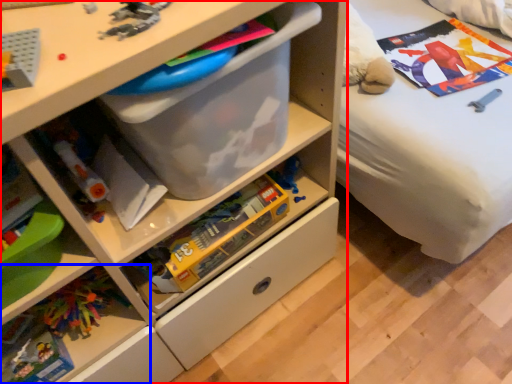
Question: Which object is further to the camera taking this photo, chest of drawers (highlighted by a red box) or shelf (highlighted by a blue box)?

Choices:
 (A) chest of drawers
 (B) shelf

Answer: (B)